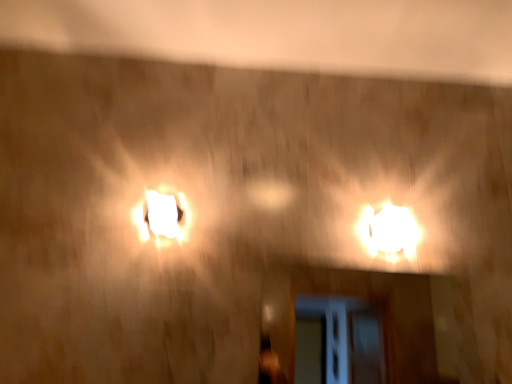
Question: Is white glossy lampshade at center, acting as the first lamp starting from the left, spatially inside bright white plastic lamp at right, which ranks as the 1th lamp in right-to-left order, or outside of it?

Choices:
 (A) outside
 (B) inside

Answer: (A)

Question: Is point (162, 221) closer or farther from the camera than point (387, 254)?

Choices:
 (A) farther
 (B) closer

Answer: (B)

Question: Considering the positions of white glossy lampshade at center, the 2th lamp positioned from the right, and bright white plastic lamp at right, which ranks as the 1th lamp in right-to-left order, in the image, is white glossy lampshade at center, the 2th lamp positioned from the right, wider or thinner than bright white plastic lamp at right, which ranks as the 1th lamp in right-to-left order,?

Choices:
 (A) wide
 (B) thin

Answer: (B)

Question: Is point (412, 221) closer or farther from the camera than point (179, 218)?

Choices:
 (A) closer
 (B) farther

Answer: (B)

Question: Choose the correct answer: Is bright white plastic lamp at right, the 2th lamp positioned from the left, inside white glossy lampshade at center, acting as the first lamp starting from the left, or outside it?

Choices:
 (A) inside
 (B) outside

Answer: (B)

Question: Would you say bright white plastic lamp at right, the 2th lamp positioned from the left, is to the left or to the right of white glossy lampshade at center, the 2th lamp positioned from the right, in the picture?

Choices:
 (A) right
 (B) left

Answer: (A)

Question: Is bright white plastic lamp at right, which ranks as the 1th lamp in right-to-left order, taller or shorter than white glossy lampshade at center, acting as the first lamp starting from the left?

Choices:
 (A) short
 (B) tall

Answer: (B)